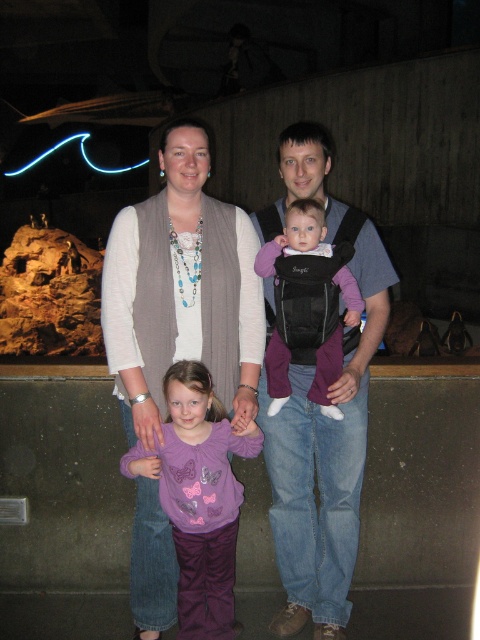
Question: Is matte gray vest at center bigger than purple fleece carrier at center?

Choices:
 (A) yes
 (B) no

Answer: (A)

Question: Does denim jeans at center come behind purple satin shirt at lower center?

Choices:
 (A) no
 (B) yes

Answer: (B)

Question: Which of the following is the farthest from the observer?

Choices:
 (A) (299, 204)
 (B) (354, 428)
 (C) (187, 275)
 (D) (177, 502)

Answer: (B)

Question: Does denim jeans at center have a lesser width compared to purple satin shirt at lower center?

Choices:
 (A) no
 (B) yes

Answer: (A)

Question: Estimate the real-world distances between objects in this image. Which object is farther from the denim jeans at center?

Choices:
 (A) matte gray vest at center
 (B) purple satin shirt at lower center

Answer: (B)

Question: Which of the following is the farthest from the observer?

Choices:
 (A) (216, 452)
 (B) (217, 392)
 (C) (284, 458)

Answer: (C)